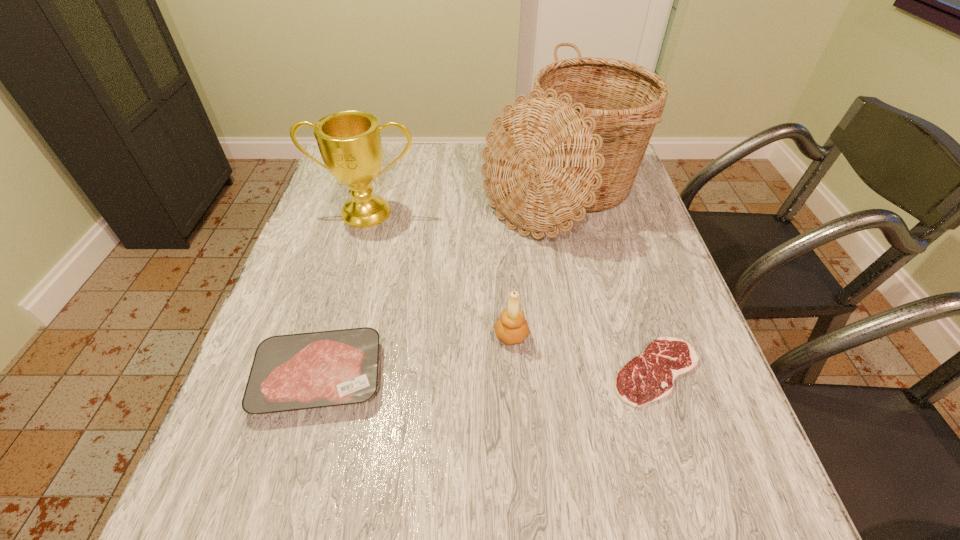
Find the location of a particular element. Image resolution: width=960 pixels, height=540 pixels. vacant point located 0.240m on the right of the left steak is located at coordinates (507, 376).

Where is `vacant space located on the left of the right steak`? This screenshot has width=960, height=540. vacant space located on the left of the right steak is located at coordinates (476, 372).

At what (x,y) coordinates should I click in order to perform the action: click on object that is at the far edge. Please return your answer as a coordinate pair (x, y). This screenshot has width=960, height=540. Looking at the image, I should click on (575, 145).

Image resolution: width=960 pixels, height=540 pixels. In order to click on award present at the left edge in this screenshot , I will do `click(349, 142)`.

The image size is (960, 540). Identify the location of steak positioned at the left edge. (289, 372).

This screenshot has height=540, width=960. Identify the location of basket at the right edge. (575, 145).

Locate an element on the screen. The width and height of the screenshot is (960, 540). steak located at the right edge is located at coordinates (648, 377).

At what (x,y) coordinates should I click in order to perform the action: click on object that is at the far right corner. Please return your answer as a coordinate pair (x, y). This screenshot has width=960, height=540. Looking at the image, I should click on (575, 145).

Find the location of `free space at the far edge of the desktop`. free space at the far edge of the desktop is located at coordinates (399, 143).

Find the location of `vacant space at the near edge of the desktop`. vacant space at the near edge of the desktop is located at coordinates (464, 488).